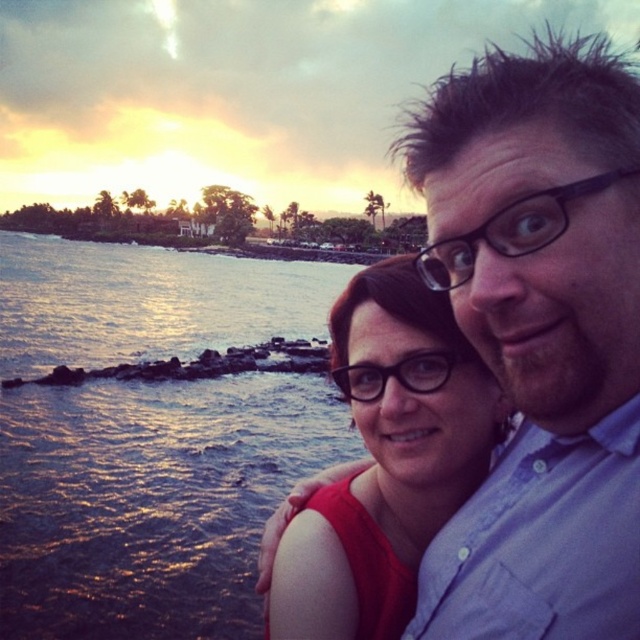
You are a photographer trying to capture the sunset scene. You notice the matte black hair at upper center and the shiny blue water at lower left. Which object should you focus on first if you want to include both in your shot without adjusting your camera settings?

The matte black hair at upper center is not as tall as the shiny blue water at lower left, so you should focus on the shiny blue water at lower left first since it is taller and will require less adjustment to capture both in focus.

Looking at this image, you are a photographer trying to capture a closeup shot of both the matte black hair at upper center and the matte red dress at center in the sunset scene. Can you fit both subjects into your camera frame if your camera has a maximum field of view that can capture objects up to 1.2 meters apart?

The matte black hair at upper center and the matte red dress at center are 1.28 meters apart. Since the distance between them exceeds the camera frame limit of 1.2 meters, you cannot fit both subjects into the camera frame.